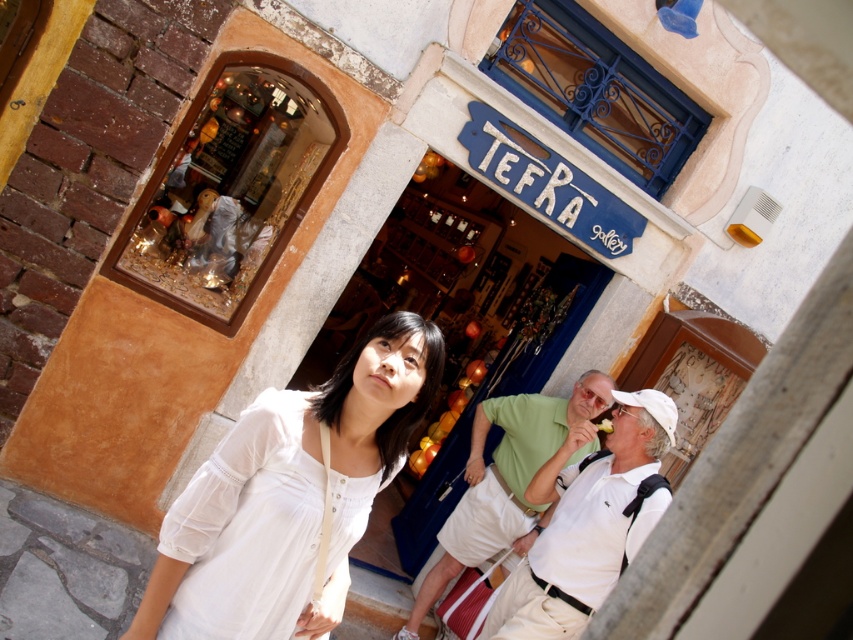
You are a tailor who needs to determine which garment has a wider width for a customer who prefers looser clothing. Based on the scene, which one between the white cotton blouse at center and the white cotton shirt at center is wider?

The white cotton shirt at center has a wider width than the white cotton blouse at center, so it would be the better choice for someone preferring looser clothing.

You are a photographer trying to capture both the white cotton shirt at lower right and the white cotton shirt at center in a single frame. Since you want to emphasize the smaller one, which shirt should you position closer to the camera?

The white cotton shirt at lower right is smaller than the white cotton shirt at center. To emphasize the smaller one, position the white cotton shirt at lower right closer to the camera to make it appear larger in the frame.

Where is the white cotton blouse at center located in the image?

The white cotton blouse at center is located at point (x=288, y=493).